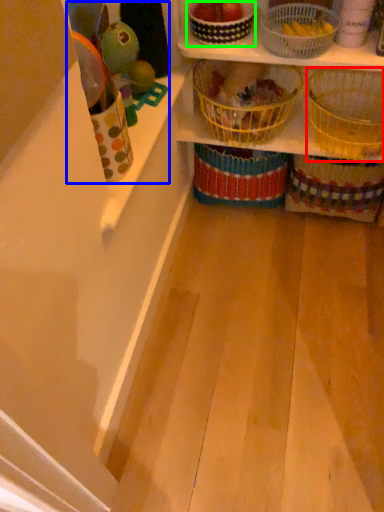
Question: Which is nearer to the basket (highlighted by a red box)? toy (highlighted by a blue box) or basket (highlighted by a green box).

Choices:
 (A) toy
 (B) basket

Answer: (B)